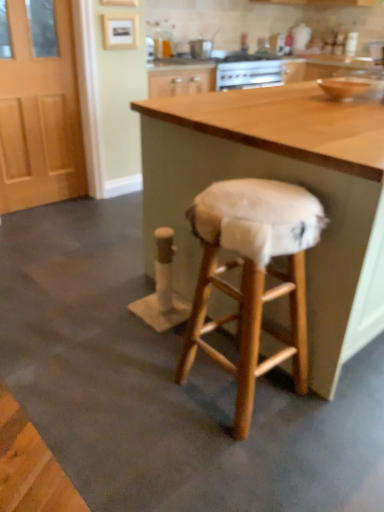
Image resolution: width=384 pixels, height=512 pixels. Describe the element at coordinates (280, 180) in the screenshot. I see `wooden table at center` at that location.

At what (x,y) coordinates should I click in order to perform the action: click on white fabric-covered stool at center. Please return your answer as a coordinate pair (x, y). The height and width of the screenshot is (512, 384). Looking at the image, I should click on (252, 276).

What do you see at coordinates (39, 106) in the screenshot? I see `light brown wooden door at left` at bounding box center [39, 106].

The height and width of the screenshot is (512, 384). Identify the location of wooden table at center. click(x=280, y=180).

Which of these two, light brown wooden door at left or white fabric-covered stool at center, is thinner?

Thinner between the two is light brown wooden door at left.

In the scene shown: Which object is positioned more to the left, light brown wooden door at left or white fabric-covered stool at center?

light brown wooden door at left is more to the left.

From a real-world perspective, which is physically above, light brown wooden door at left or white fabric-covered stool at center?

light brown wooden door at left, from a real-world perspective.

Does light brown wooden door at left turn towards white fabric-covered stool at center?

Yes, light brown wooden door at left is turned towards white fabric-covered stool at center.

From a real-world perspective, is white fabric-covered stool at center beneath light brown wooden door at left?

Yes, from a real-world perspective, white fabric-covered stool at center is under light brown wooden door at left.

Considering the positions of objects white fabric-covered stool at center and light brown wooden door at left in the image provided, who is in front, white fabric-covered stool at center or light brown wooden door at left?

white fabric-covered stool at center is more forward.

From the image's perspective, is white fabric-covered stool at center above light brown wooden door at left?

Incorrect, from the image's perspective, white fabric-covered stool at center is lower than light brown wooden door at left.

How different are the orientations of white fabric-covered stool at center and light brown wooden door at left in degrees?

88.1 degrees separate the facing orientations of white fabric-covered stool at center and light brown wooden door at left.

Is point (239, 413) farther from camera compared to point (237, 121)?

No, it is in front of (237, 121).

What are the coordinates of `stool on the left side of wooden table at center` in the screenshot? It's located at (252, 276).

Between white fabric-covered stool at center and wooden table at center, which one has smaller width?

Thinner between the two is white fabric-covered stool at center.

Looking at this image, does wooden table at center lie in front of light brown wooden door at left?

Yes, it is.

From the image's perspective, is wooden table at center on light brown wooden door at left?

No.

Are wooden table at center and light brown wooden door at left making contact?

There is a gap between wooden table at center and light brown wooden door at left.

From the picture: Considering the relative positions of light brown wooden door at left and wooden table at center in the image provided, is light brown wooden door at left in front of wooden table at center?

No, light brown wooden door at left is behind wooden table at center.

Are light brown wooden door at left and wooden table at center making contact?

No, light brown wooden door at left is not next to wooden table at center.

Consider the image. In terms of width, does light brown wooden door at left look wider or thinner when compared to wooden table at center?

light brown wooden door at left is thinner than wooden table at center.

At what (x,y) coordinates should I click in order to perform the action: click on screen door located behind the wooden table at center. Please return your answer as a coordinate pair (x, y). The width and height of the screenshot is (384, 512). Looking at the image, I should click on (x=39, y=106).

Is wooden table at center looking in the opposite direction of white fabric-covered stool at center?

No, wooden table at center is not facing the opposite direction of white fabric-covered stool at center.

Are wooden table at center and white fabric-covered stool at center making contact?

No, wooden table at center is not in contact with white fabric-covered stool at center.

From the image's perspective, is wooden table at center above or below white fabric-covered stool at center?

From the image's perspective, wooden table at center appears above white fabric-covered stool at center.

From a real-world perspective, relative to white fabric-covered stool at center, is wooden table at center vertically above or below?

Clearly, from a real-world perspective, wooden table at center is above white fabric-covered stool at center.

In the image, there is a white fabric-covered stool at center. In order to click on screen door above it (from the image's perspective) in this screenshot , I will do `click(39, 106)`.

The width and height of the screenshot is (384, 512). What are the coordinates of `screen door above the white fabric-covered stool at center (from a real-world perspective)` in the screenshot? It's located at (39, 106).

Looking at the image, which one is located closer to light brown wooden door at left, white fabric-covered stool at center or wooden table at center?

wooden table at center lies closer to light brown wooden door at left than the other object.

Estimate the real-world distances between objects in this image. Which object is further from light brown wooden door at left, wooden table at center or white fabric-covered stool at center?

The object further to light brown wooden door at left is white fabric-covered stool at center.

Estimate the real-world distances between objects in this image. Which object is further from wooden table at center, light brown wooden door at left or white fabric-covered stool at center?

light brown wooden door at left lies further to wooden table at center than the other object.

When comparing their distances from white fabric-covered stool at center, does light brown wooden door at left or wooden table at center seem further?

light brown wooden door at left.

Based on their spatial positions, is wooden table at center or light brown wooden door at left further from white fabric-covered stool at center?

light brown wooden door at left is further to white fabric-covered stool at center.

Based on their spatial positions, is white fabric-covered stool at center or light brown wooden door at left further from wooden table at center?

The object further to wooden table at center is light brown wooden door at left.

Find the location of `stool between light brown wooden door at left and wooden table at center`. stool between light brown wooden door at left and wooden table at center is located at coordinates (252, 276).